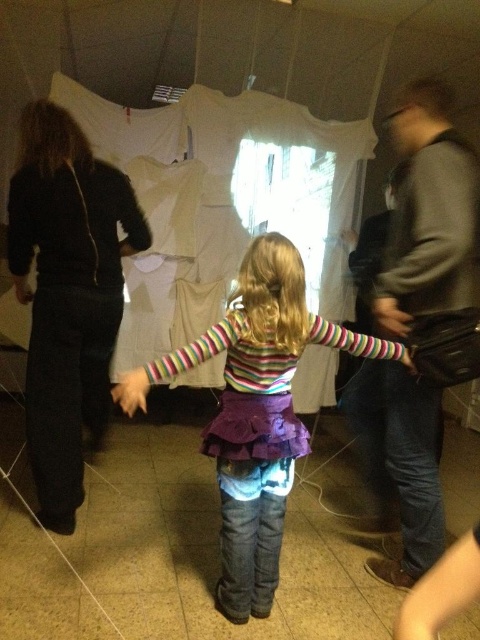
Question: Is smooth beige hand at center further to the viewer compared to leather handbag at right?

Choices:
 (A) no
 (B) yes

Answer: (A)

Question: Which point is closer to the camera taking this photo?

Choices:
 (A) (389, 305)
 (B) (253, 492)
 (C) (85, 380)

Answer: (B)

Question: Among these objects, which one is farthest from the camera?

Choices:
 (A) smooth black hand at lower left
 (B) black fabric pants at left

Answer: (A)

Question: Is striped fabric at center below smooth leather handbag at lower right?

Choices:
 (A) no
 (B) yes

Answer: (B)

Question: Considering the real-world distances, which object is farthest from the smooth beige hand at center?

Choices:
 (A) smooth black hand at lower left
 (B) dark gray sweater at right

Answer: (B)

Question: Is striped fabric at center thinner than smooth black hand at lower left?

Choices:
 (A) yes
 (B) no

Answer: (B)